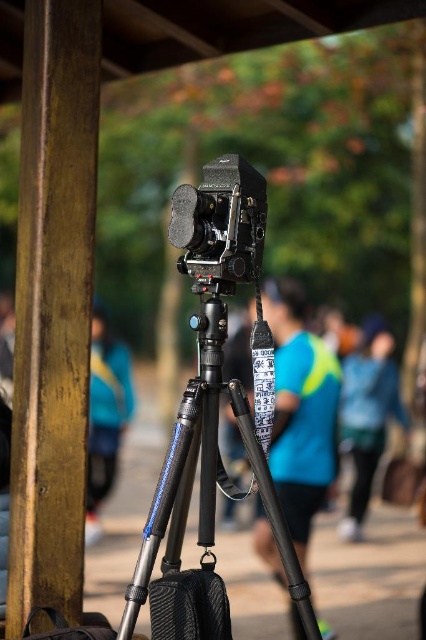
You are a photographer setting up your equipment in the park. You notice two blue fabric items in the scene. Which one is taller, the blue fabric shirt at center or the blue fabric jacket at lower right?

The blue fabric shirt at center is taller than the blue fabric jacket at lower right according to the description.

You are a photographer who wants to set up your equipment. You have a camera with a lens that requires a minimum distance of 1.2 meters from the subject to focus properly. You are standing at point A, which is 1.5 meters away from the metallic tripod at center. If you move towards the tripod, will you be able to focus on the subject once you reach the tripod?

The metallic tripod at center is positioned at point (x=204, y=506). Since you are initially 1.5 meters away from the tripod and move closer to it, your distance from the subject would decrease below the required 1.2 meters minimum distance needed for proper focus. Therefore, once you reach the tripod, you will be too close to focus properly.

You are a photographer carrying a heavy camera and tripod. You need to place your equipment on the ground without blocking the path between the wooden pole at left and the blue fabric bag at left. Is there enough space between them to do so?

The distance between the wooden pole at left and the blue fabric bag at left is 8.95 feet, which is sufficient space to place your equipment without blocking the path between them.